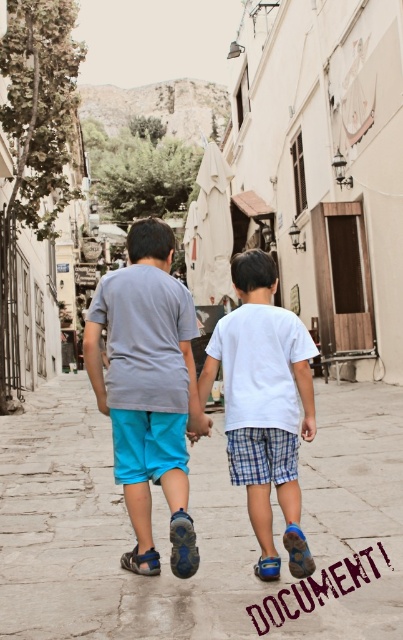
Question: Which is nearer to the white cotton shirt at center?

Choices:
 (A) smooth stone pavement at center
 (B) matte gray t-shirt at center

Answer: (B)

Question: Which point is farther from the camera taking this photo?

Choices:
 (A) tap(159, 456)
 (B) tap(307, 371)

Answer: (A)

Question: Is smooth stone pavement at center above matte gray t-shirt at center?

Choices:
 (A) no
 (B) yes

Answer: (A)

Question: Based on their relative distances, which object is farther from the smooth stone pavement at center?

Choices:
 (A) white cotton shirt at center
 (B) matte gray t-shirt at center

Answer: (B)

Question: Does smooth stone pavement at center appear under matte gray t-shirt at center?

Choices:
 (A) no
 (B) yes

Answer: (B)

Question: Is matte gray t-shirt at center smaller than white cotton shirt at center?

Choices:
 (A) yes
 (B) no

Answer: (B)